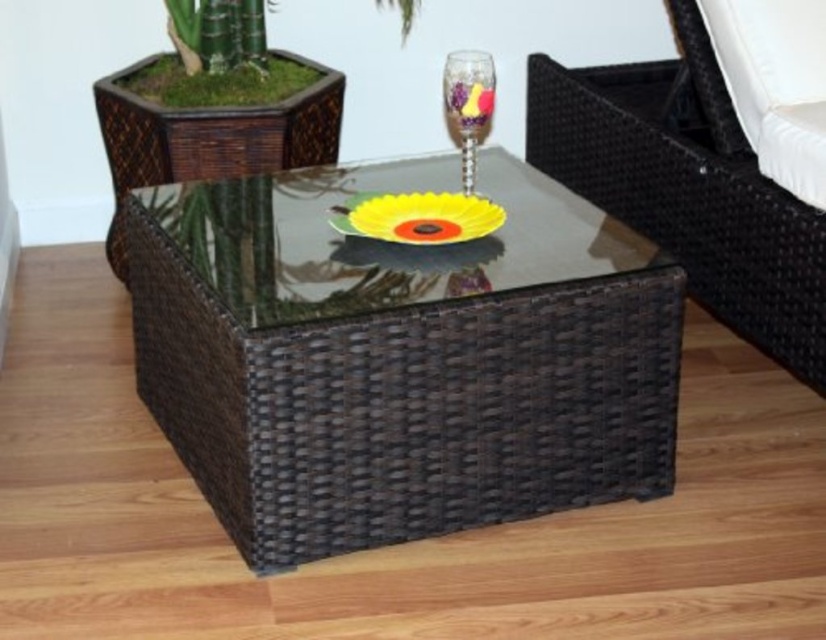
Question: Which of the following is the closest to the observer?

Choices:
 (A) [775, 188]
 (B) [463, 118]
 (C) [489, 84]
 (D) [254, 508]

Answer: (D)

Question: Observing the image, what is the correct spatial positioning of brown wicker chair at center in reference to translucent glass wine glass at center?

Choices:
 (A) above
 (B) below

Answer: (B)

Question: Which point is closer to the camera?

Choices:
 (A) (482, 113)
 (B) (665, 342)
 (C) (691, 104)
 (D) (454, 104)

Answer: (B)

Question: Does brown wicker chair at center have a larger size compared to translucent glass flower at center?

Choices:
 (A) no
 (B) yes

Answer: (B)

Question: Does brown wicker table at center appear over brown wicker chair at center?

Choices:
 (A) yes
 (B) no

Answer: (B)

Question: Which of the following is the farthest from the observer?

Choices:
 (A) brown wicker table at center
 (B) translucent glass wine glass at center
 (C) translucent glass flower at center

Answer: (C)